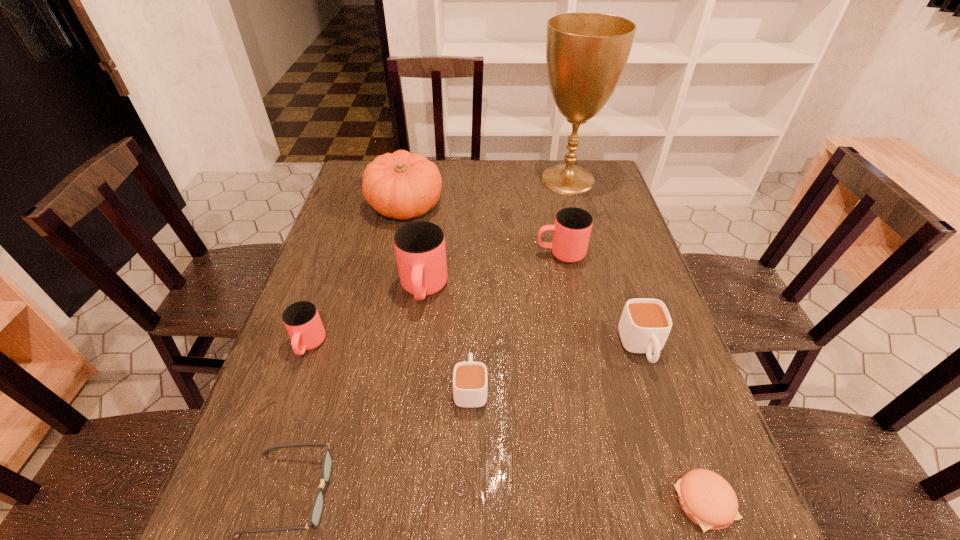
What are the coordinates of `free space at the far edge of the desktop` in the screenshot? It's located at (492, 172).

Identify the location of vacant space at the left edge. (330, 280).

The height and width of the screenshot is (540, 960). In the image, there is a desktop. What are the coordinates of `free space at the right edge` in the screenshot? It's located at (619, 219).

This screenshot has height=540, width=960. Find the location of `vacant space at the far left corner`. vacant space at the far left corner is located at coordinates (359, 164).

At what (x,y) coordinates should I click in order to perform the action: click on blank space at the near right corner. Please return your answer as a coordinate pair (x, y). Image resolution: width=960 pixels, height=540 pixels. Looking at the image, I should click on [727, 534].

The width and height of the screenshot is (960, 540). What are the coordinates of `vacant region between the fifth object from right to left and the orange pumpkin` in the screenshot? It's located at pyautogui.click(x=438, y=296).

At what (x,y) coordinates should I click in order to perform the action: click on free space between the pumpkin and the patty. Please return your answer as a coordinate pair (x, y). Image resolution: width=960 pixels, height=540 pixels. Looking at the image, I should click on (555, 355).

Image resolution: width=960 pixels, height=540 pixels. I want to click on free spot between the orange pumpkin and the gray spectacles, so click(x=348, y=350).

The image size is (960, 540). In order to click on vacant area that lies between the rightmost cup and the tallest cup in this screenshot , I will do `click(533, 319)`.

Where is `free point between the right white cup and the pumpkin`? free point between the right white cup and the pumpkin is located at coordinates (523, 277).